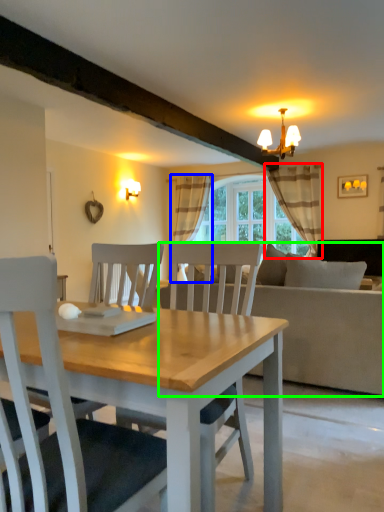
Question: Which is nearer to the curtain (highlighted by a red box)? curtain (highlighted by a blue box) or studio couch (highlighted by a green box).

Choices:
 (A) curtain
 (B) studio couch

Answer: (A)